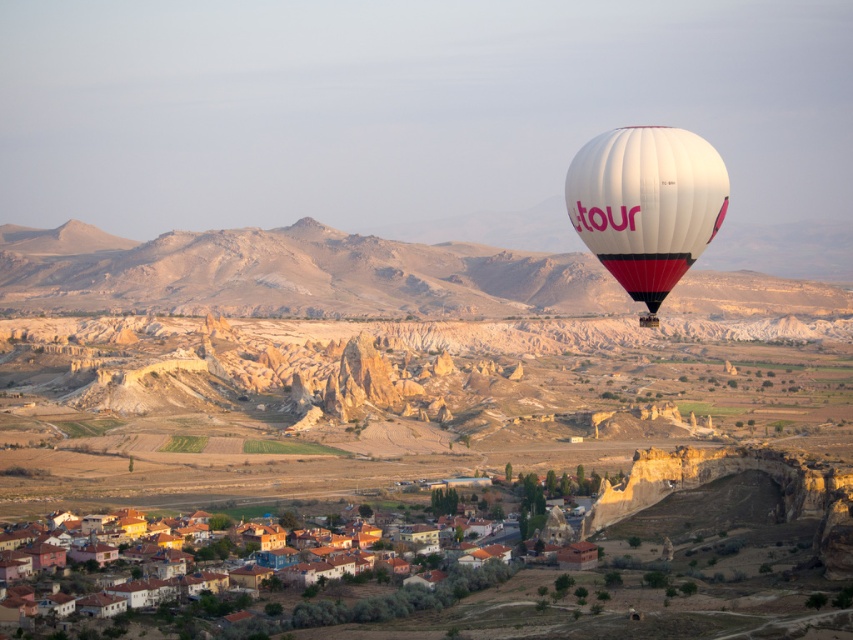
You are standing at the point with coordinates point (689, 147) and want to move towards the point with coordinates point (312, 620). Which direction should you move to get closer to your destination?

To move from point (689, 147) towards point (312, 620), you should move southeast since point (312, 620) is located to the southeast of point (689, 147).

You are standing at the point marked by the coordinate point (646, 205) in the image. What object are you directly facing?

The point (646, 205) marks the white fabric balloon at right, so you are directly facing the white fabric balloon at right.